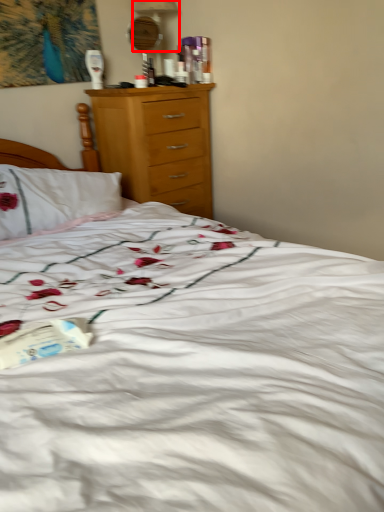
Question: Considering the relative positions of table lamp (annotated by the red box) and paperback book in the image provided, where is table lamp (annotated by the red box) located with respect to the staircase?

Choices:
 (A) right
 (B) left

Answer: (A)